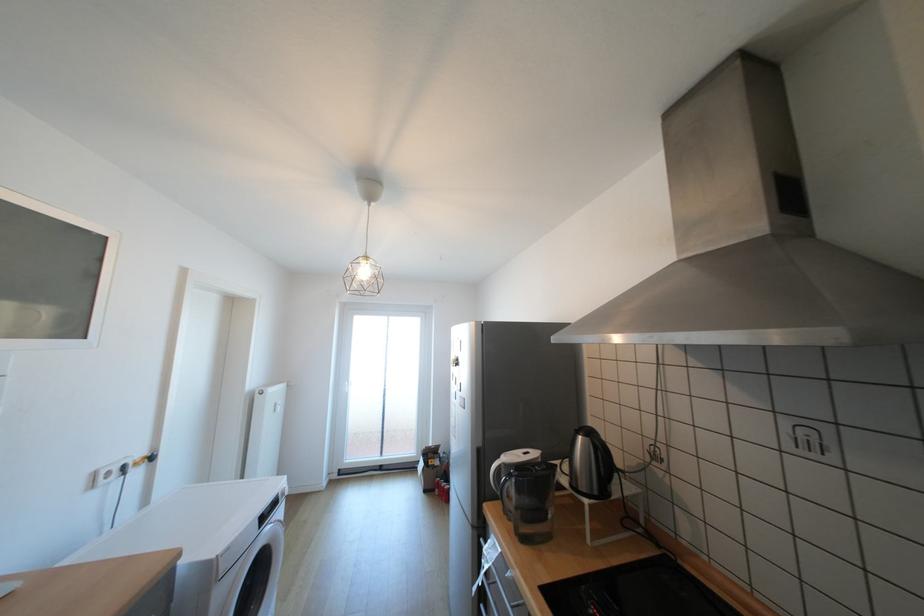
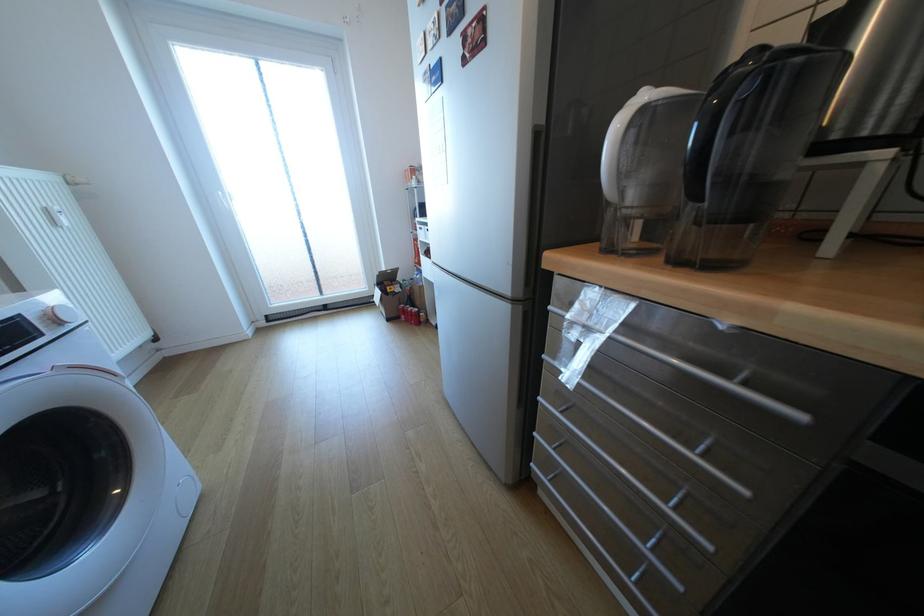
Find the pixel in the second image that matches [445,490] in the first image.

(411, 315)